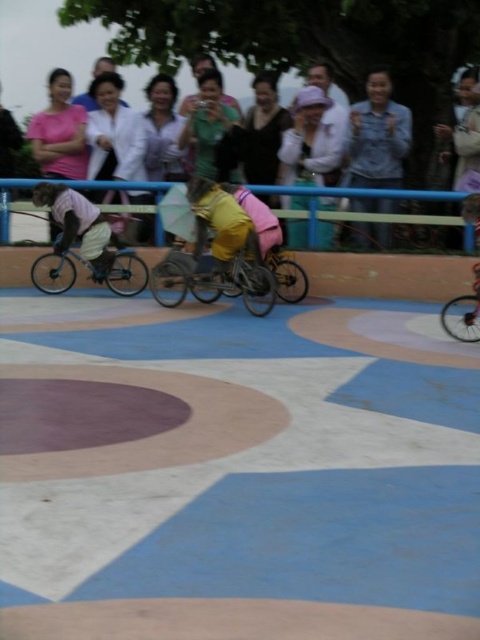
Question: Based on their relative distances, which object is nearer to the matte green shirt at center?

Choices:
 (A) pink fabric at upper center
 (B) matte yellow pants at center
 (C) shiny metallic bicycle at center

Answer: (A)

Question: Is denim jacket at upper center to the right of matte pink shirt at upper center from the viewer's perspective?

Choices:
 (A) no
 (B) yes

Answer: (B)

Question: Among these points, which one is farthest from the camera?

Choices:
 (A) (74, 134)
 (B) (276, 152)
 (C) (168, 97)
 (D) (300, 182)

Answer: (C)

Question: Which point is closer to the camera taking this photo?

Choices:
 (A) (371, 160)
 (B) (208, 70)

Answer: (A)

Question: Is blue metal rail at center to the right of matte yellow shirt at center from the viewer's perspective?

Choices:
 (A) no
 (B) yes

Answer: (B)

Question: Does white lab coat at upper center appear on the right side of pink fabric at upper left?

Choices:
 (A) yes
 (B) no

Answer: (A)